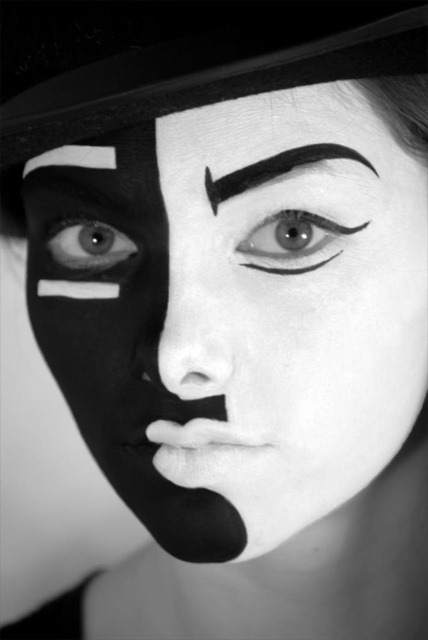
Consider the image. You are an artist analyzing the portrait. You notice the smooth matte nose at center and the matte black eye at center. Which object is taller in the image?

The smooth matte nose at center is taller than the matte black eye at center.

Looking at the artistic makeup in the portrait, where is the smooth matte nose at center in relation to the matte black eye at center?

The smooth matte nose at center is to the right of the matte black eye at center.